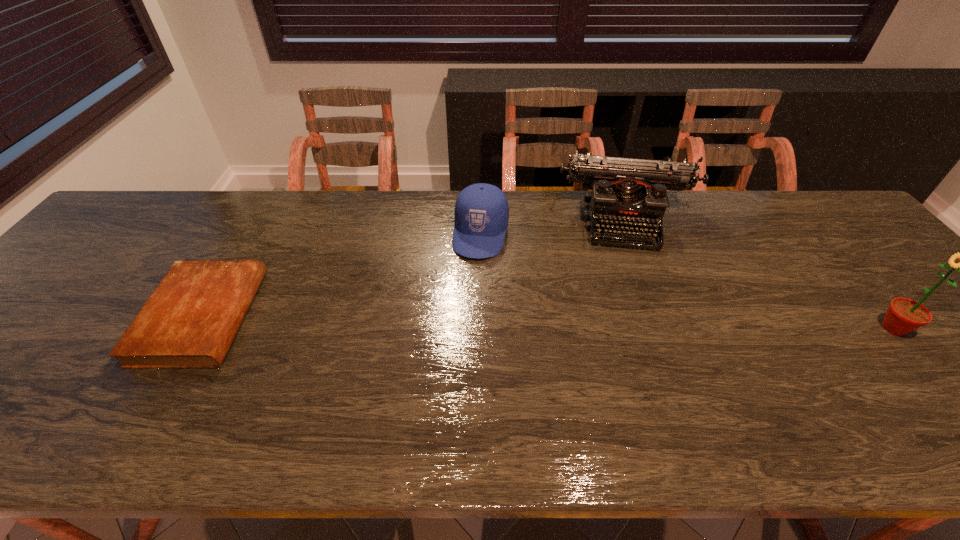
The width and height of the screenshot is (960, 540). I want to click on vacant position located on the face of the rightmost object, so click(x=732, y=328).

Locate an element on the screen. vacant space positioned on the face of the rightmost object is located at coordinates (838, 328).

Locate an element on the screen. The image size is (960, 540). vacant space located 0.340m on the keyboard of the typewriter is located at coordinates click(648, 352).

Locate an element on the screen. vacant point located 0.080m on the keyboard of the typewriter is located at coordinates (634, 272).

Locate an element on the screen. This screenshot has height=540, width=960. vacant space located 0.170m on the keyboard of the typewriter is located at coordinates (638, 296).

The image size is (960, 540). I want to click on vacant space located on the front-facing side of the cap, so click(467, 305).

This screenshot has height=540, width=960. I want to click on vacant position located 0.390m on the front-facing side of the cap, so click(447, 386).

At what (x,y) coordinates should I click in order to perform the action: click on vacant space situated 0.130m on the front-facing side of the cap. Please return your answer as a coordinate pair (x, y). Looking at the image, I should click on pyautogui.click(x=468, y=296).

This screenshot has height=540, width=960. Find the location of `typewriter that is at the far edge`. typewriter that is at the far edge is located at coordinates (631, 193).

I want to click on cap present at the far edge, so click(x=481, y=215).